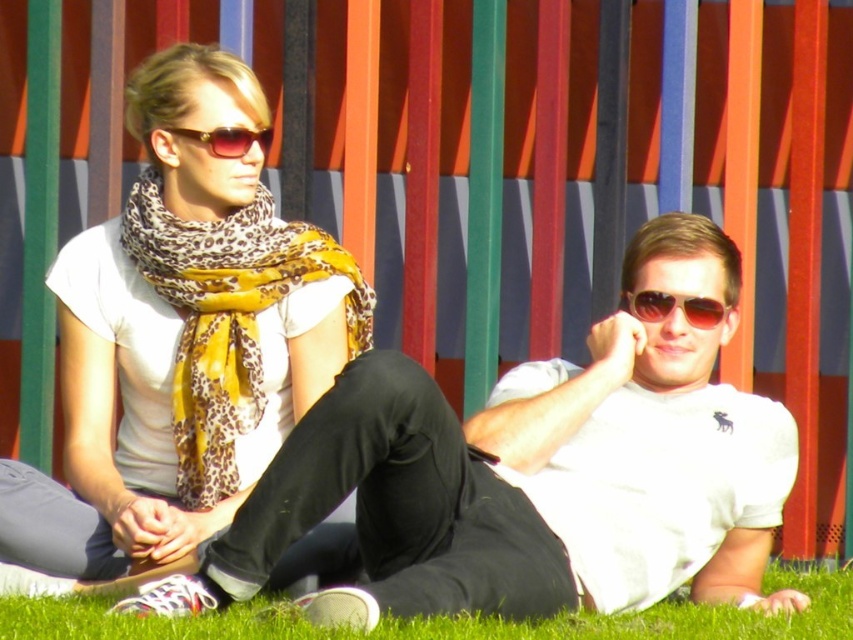
You are taking a photo of the scene and want to focus on the sunglasses at center. Which direction should you move your camera to frame the green grass at lower center in the shot?

The green grass at lower center is to the right of the sunglasses at center, so you should move your camera to the right to frame the green grass at lower center.

You are standing in the scene and want to sit down on the green grass at lower center. Based on its position coordinates, can you estimate how far you need to walk forward from your current position to reach it?

The green grass at lower center is located at coordinates point (453,620), which means it is very close to the bottom center of the scene. Since you are already standing in the scene, you would only need to walk a short distance forward to reach it.

You are a photographer taking a picture of the leopard print scarf at left and the sunglasses at upper center. Which object is closer to the camera?

The leopard print scarf at left is positioned under the sunglasses at upper center, so the sunglasses at upper center are closer to the camera.